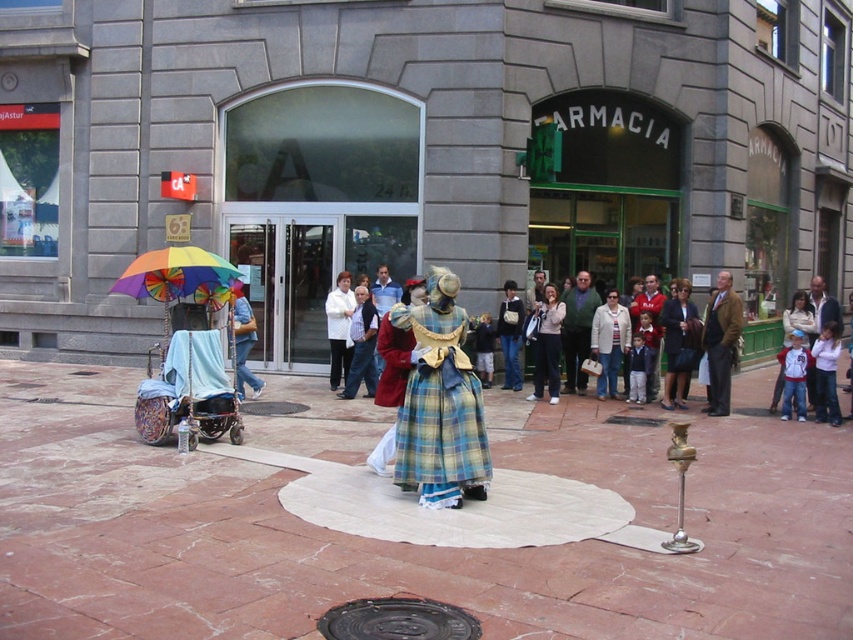
Question: Can you confirm if smooth brick pavement at center is smaller than black rubber manhole cover at center?

Choices:
 (A) no
 (B) yes

Answer: (A)

Question: Which of the following is the closest to the observer?

Choices:
 (A) (486, 465)
 (B) (55, 579)
 (C) (152, 273)

Answer: (B)

Question: Which of the following is the closest to the observer?

Choices:
 (A) brown leather jacket at center
 (B) plaid fabric dress at center
 (C) rainbow fabric umbrella at left

Answer: (B)

Question: Among these objects, which one is farthest from the camera?

Choices:
 (A) black rubber manhole cover at center
 (B) rainbow fabric umbrella at left
 (C) smooth brick pavement at center

Answer: (B)

Question: Is rainbow fabric umbrella at left thinner than matte pink sweater at center?

Choices:
 (A) no
 (B) yes

Answer: (A)

Question: Does smooth brick pavement at center have a greater width compared to black rubber manhole cover at center?

Choices:
 (A) no
 (B) yes

Answer: (B)